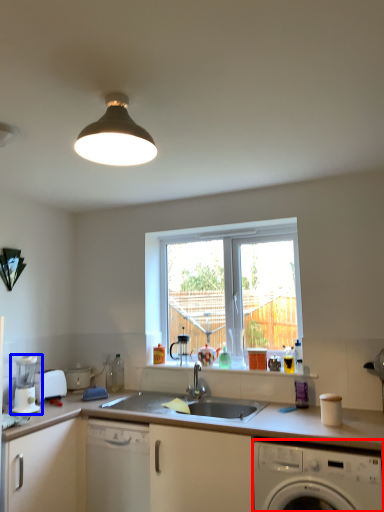
Question: Which object appears farthest to the camera in this image, washing machine (highlighted by a red box) or coffee machine (highlighted by a blue box)?

Choices:
 (A) washing machine
 (B) coffee machine

Answer: (B)